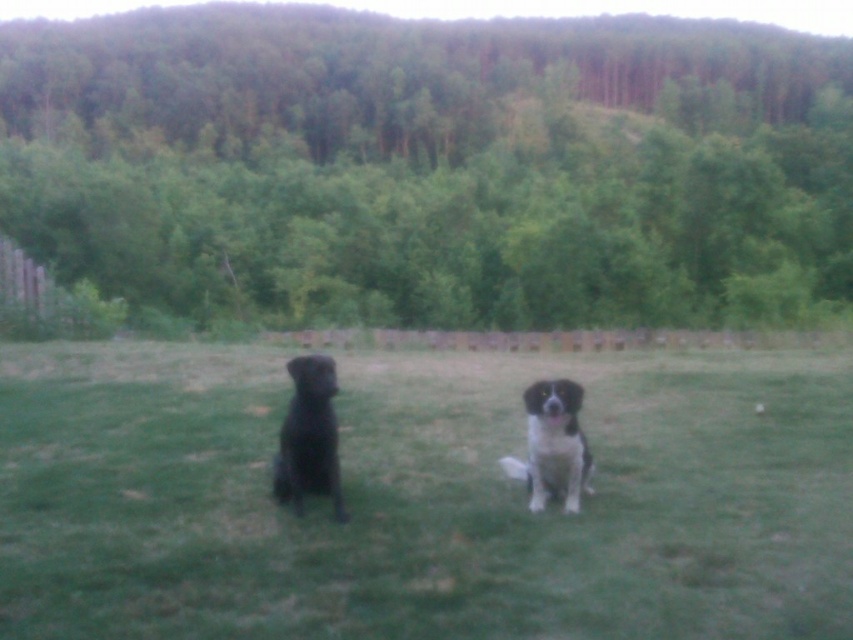
You are a photographer standing at the center of the field. You want to take a photo of the black matte dog at left. Where should you position yourself to capture the dog in the frame?

The black matte dog at left is located at point (309, 436). To capture it in the frame, position yourself so that your camera is aimed towards those coordinates.

You are a photographer trying to capture both dogs in a single frame. Given that the black fur dog at center is larger than the black and white fur dog at center, which dog should you position closer to the camera to ensure both appear proportionally sized in the photo?

To make both dogs appear proportionally sized in the photo, you should position the smaller black and white fur dog at center closer to the camera since the black fur dog at center is larger. This adjustment will help balance their sizes in the frame.

You are a dog trainer assessing the two dogs in the image. Which dog, the black fur dog at center or the black and white fur dog at center, is taller?

The black fur dog at center is taller than the black and white fur dog at center.